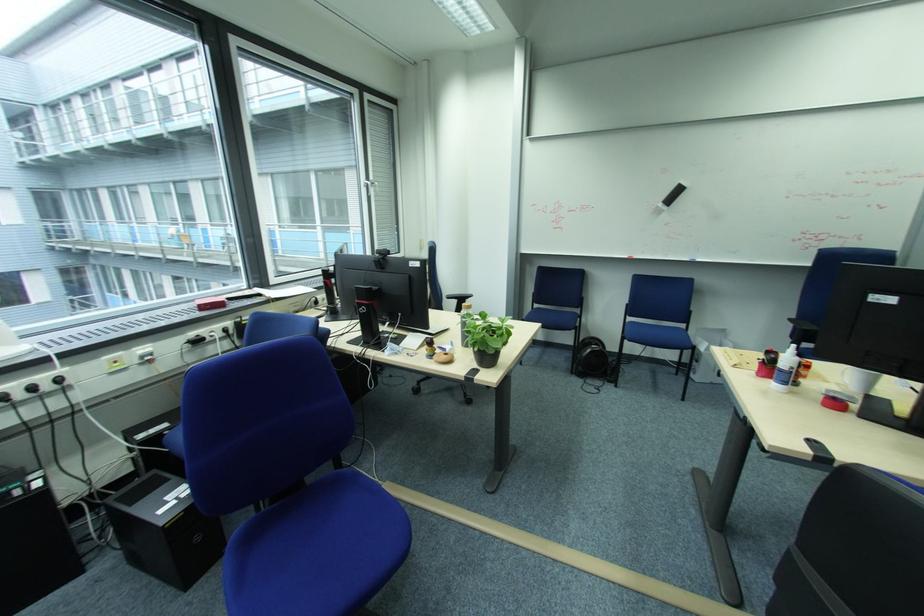
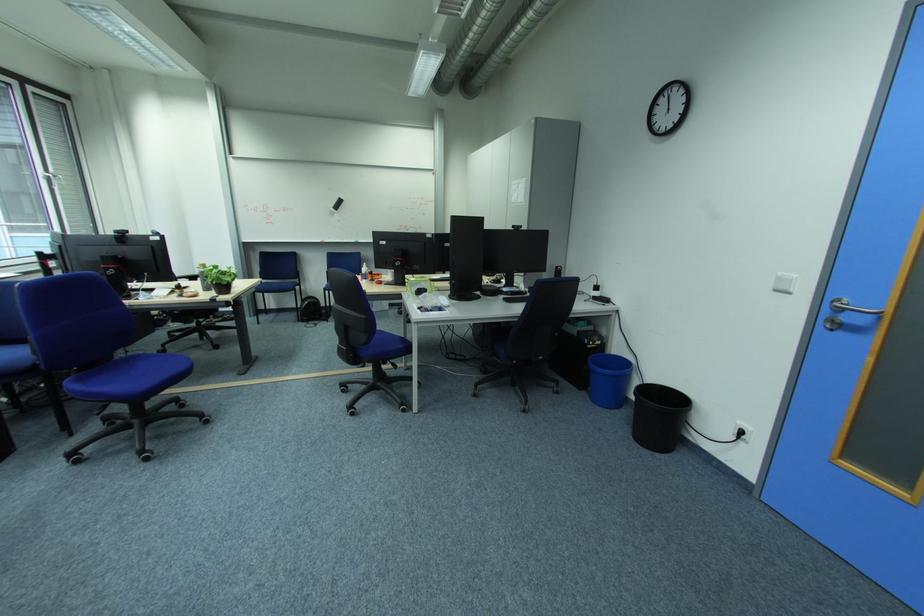
The point at (x=484, y=350) is marked in the first image. Where is the corresponding point in the second image?

(224, 284)